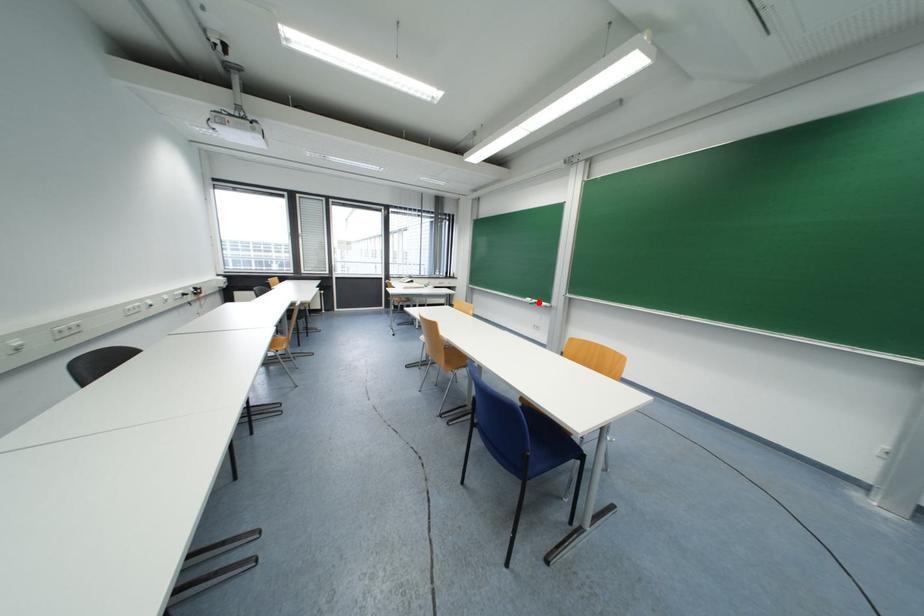
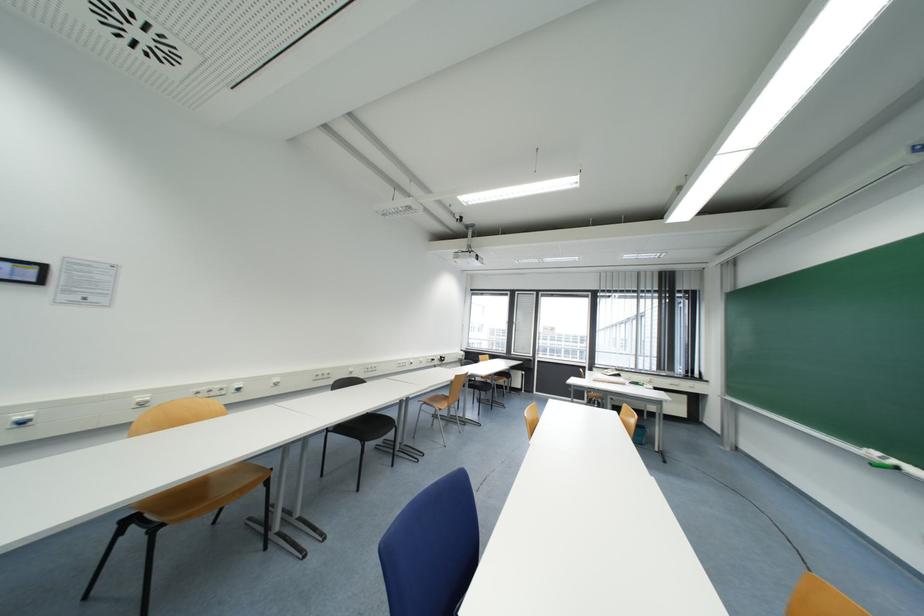
Find the pixel in the second image that matches the highlighted location in the first image.

(898, 464)